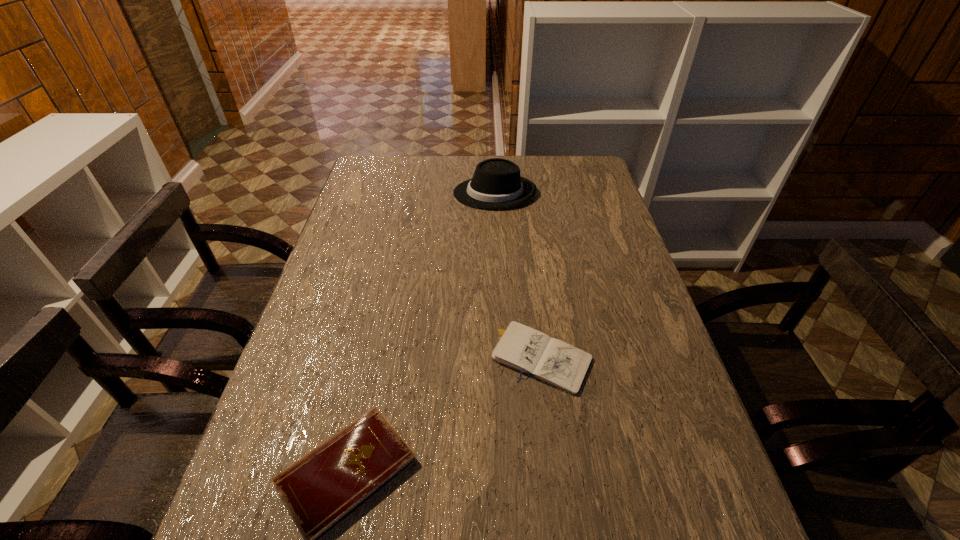
This screenshot has width=960, height=540. I want to click on the farthest object, so click(496, 184).

Locate an element on the screen. fedora is located at coordinates (496, 184).

You are a GUI agent. You are given a task and a screenshot of the screen. Output one action in this format:
    pyautogui.click(x=<x>, y=<y>)
    Task: Click on the second farthest object
    The height and width of the screenshot is (540, 960).
    Given the screenshot: What is the action you would take?
    [x=521, y=348]

At what (x,y) coordinates should I click in order to perform the action: click on the farther notebook. Please return your answer as a coordinate pair (x, y). This screenshot has height=540, width=960. Looking at the image, I should click on [x=521, y=348].

Locate an element on the screen. This screenshot has width=960, height=540. vacant space located 0.240m on the front-facing side of the farthest object is located at coordinates (387, 193).

The width and height of the screenshot is (960, 540). I want to click on vacant space situated on the front-facing side of the farthest object, so click(378, 193).

Locate an element on the screen. The height and width of the screenshot is (540, 960). blank space located on the front-facing side of the farthest object is located at coordinates (425, 193).

This screenshot has width=960, height=540. I want to click on vacant space positioned on the right of the second farthest object, so click(621, 358).

Find the location of a particular element. object located at the far edge is located at coordinates (496, 184).

Image resolution: width=960 pixels, height=540 pixels. Identify the location of free region at the far edge of the desktop. (442, 165).